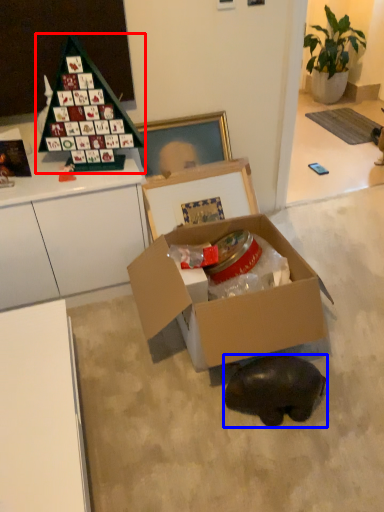
Question: Which point is further to the camera, toy (highlighted by a red box) or animal (highlighted by a blue box)?

Choices:
 (A) toy
 (B) animal

Answer: (A)